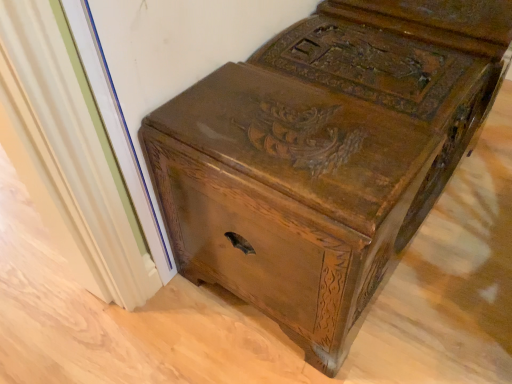
This screenshot has width=512, height=384. What are the coordinates of `vacant region above wooden carved chest at center (from a real-world perspective)` in the screenshot? It's located at (353, 73).